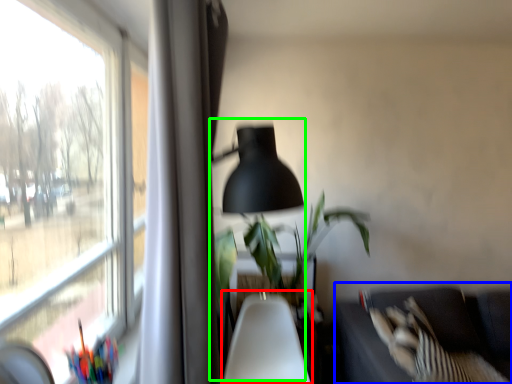
Question: Which object is the farthest from swivel chair (highlighted by a red box)? Choose among these: couch (highlighted by a blue box) or table lamp (highlighted by a green box).

Choices:
 (A) couch
 (B) table lamp

Answer: (B)